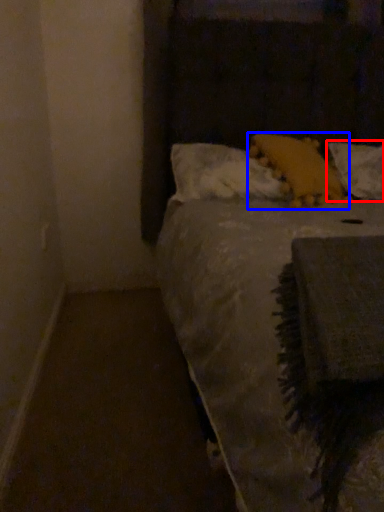
Question: Which point is closer to the camera, pillow (highlighted by a red box) or pillow (highlighted by a blue box)?

Choices:
 (A) pillow
 (B) pillow

Answer: (B)